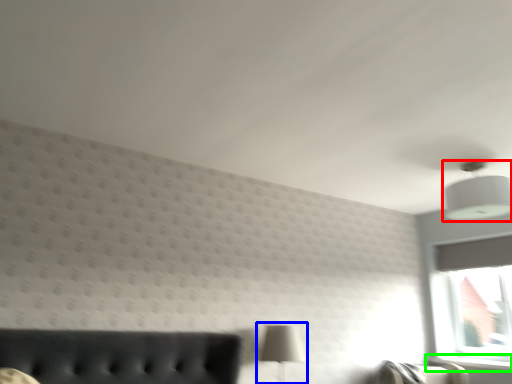
Question: Based on their relative distances, which object is nearer to lamp (highlighted by a red box)? Choose from table lamp (highlighted by a blue box) and window sill (highlighted by a green box).

Choices:
 (A) table lamp
 (B) window sill

Answer: (A)